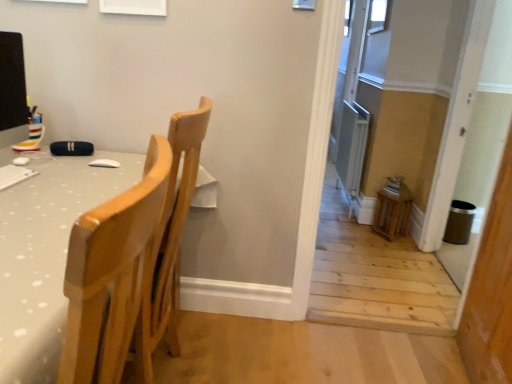
Question: From a real-world perspective, is transparent glass window at upper center, which appears as the first window when viewed from the back, physically below clear glass window at upper right, the first window ordered from the bottom?

Choices:
 (A) no
 (B) yes

Answer: (A)

Question: Is transparent glass window at upper center, acting as the first window starting from the top, at the right side of clear glass window at upper right, the second window when ordered from top to bottom?

Choices:
 (A) no
 (B) yes

Answer: (B)

Question: Does transparent glass window at upper center, which is the second window from front to back, have a lesser width compared to clear glass window at upper right, the first window positioned from the front?

Choices:
 (A) no
 (B) yes

Answer: (A)

Question: Would you say transparent glass window at upper center, the second window from the bottom, is a long distance from clear glass window at upper right, the second window when ordered from top to bottom?

Choices:
 (A) no
 (B) yes

Answer: (A)

Question: Is the position of transparent glass window at upper center, which appears as the first window when viewed from the back, less distant than that of clear glass window at upper right, placed as the 2th window when sorted from right to left?

Choices:
 (A) no
 (B) yes

Answer: (A)

Question: Can you confirm if transparent glass window at upper center, acting as the first window starting from the top, is taller than clear glass window at upper right, the second window when ordered from top to bottom?

Choices:
 (A) yes
 (B) no

Answer: (A)

Question: Could you tell me if matte black monitor at left is turned towards transparent glass window at upper center, which appears as the first window when viewed from the back?

Choices:
 (A) yes
 (B) no

Answer: (B)

Question: From the image's perspective, is matte black monitor at left on transparent glass window at upper center, the second window from the bottom?

Choices:
 (A) yes
 (B) no

Answer: (B)

Question: Can transparent glass window at upper center, which is the second window from front to back, be found inside matte black monitor at left?

Choices:
 (A) yes
 (B) no

Answer: (B)

Question: Can you confirm if matte black monitor at left is taller than transparent glass window at upper center, acting as the first window starting from the top?

Choices:
 (A) no
 (B) yes

Answer: (B)

Question: Does matte black monitor at left have a greater width compared to transparent glass window at upper center, which appears as the first window when viewed from the back?

Choices:
 (A) no
 (B) yes

Answer: (B)

Question: From a real-world perspective, is matte black monitor at left under transparent glass window at upper center, acting as the first window starting from the top?

Choices:
 (A) yes
 (B) no

Answer: (A)

Question: From a real-world perspective, does matte black monitor at left stand above light wood chair at left?

Choices:
 (A) no
 (B) yes

Answer: (B)